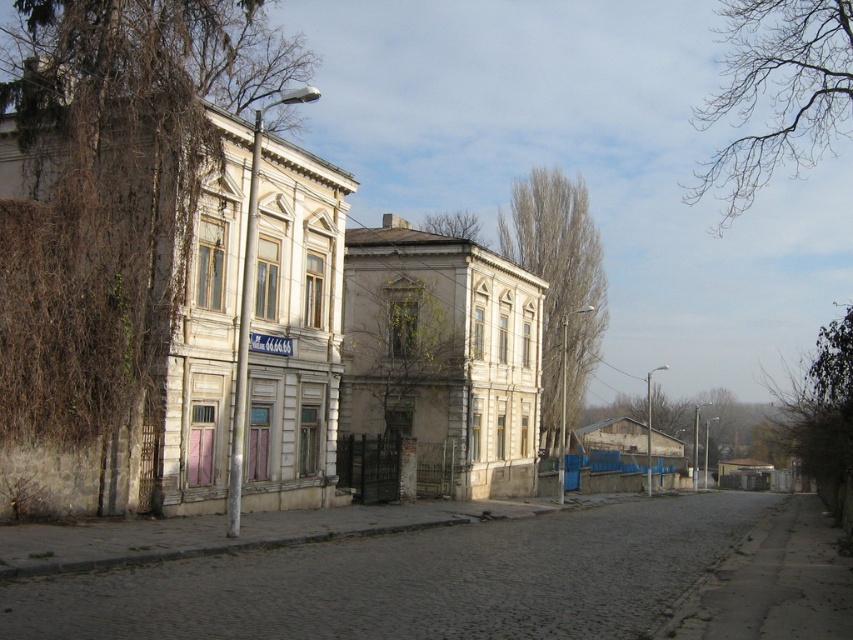
Looking at this image, between green leafy tree at center and brown textured tree at upper center, which one is positioned lower?

green leafy tree at center is below.

Is point (451, 388) closer to camera compared to point (587, 332)?

Yes, point (451, 388) is closer to viewer.

Find the location of a particular element. This screenshot has height=640, width=853. green leafy tree at center is located at coordinates (402, 355).

Which is more to the left, brown vine-covered wall at left or green leafy tree at center?

Positioned to the left is brown vine-covered wall at left.

Is brown vine-covered wall at left smaller than green leafy tree at center?

No.

Is point (125, 328) closer to viewer compared to point (386, 397)?

Yes, it is in front of point (386, 397).

You are a GUI agent. You are given a task and a screenshot of the screen. Output one action in this format:
    pyautogui.click(x=<x>, y=<y>)
    Task: Click on the brown vine-covered wall at left
    The width and height of the screenshot is (853, 640).
    Given the screenshot: What is the action you would take?
    pyautogui.click(x=112, y=196)

Can you confirm if green leafy tree at center is bigger than bare branches at upper center?

Actually, green leafy tree at center might be smaller than bare branches at upper center.

Who is more distant from viewer, [372,291] or [422,227]?

The point [422,227] is more distant.

This screenshot has height=640, width=853. Find the location of `green leafy tree at center`. green leafy tree at center is located at coordinates (402, 355).